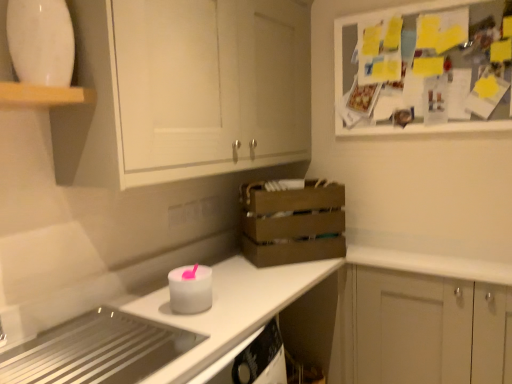
Find the location of a particular element. The image size is (512, 384). free spot in front of brown wooden crate at center is located at coordinates (270, 276).